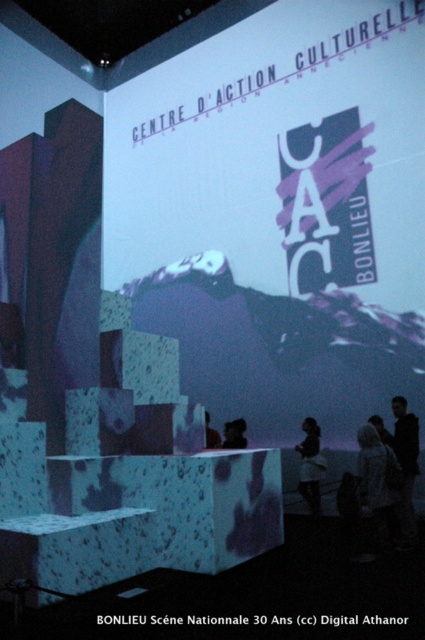
You are standing in front of the exhibition screen and notice two points marked on the projection. Which point, point (x=237, y=433) or point (x=217, y=444), is closer to you?

Point (x=237, y=433) is further to the camera than point (x=217, y=444), so the point closer to you is point (x=217, y=444).

You are standing in the exhibition hall and see the point marked at coordinates (x=235, y=435). According to the image, what object or feature is this point located on?

The point at coordinates (x=235, y=435) is located on the matte black person at center.